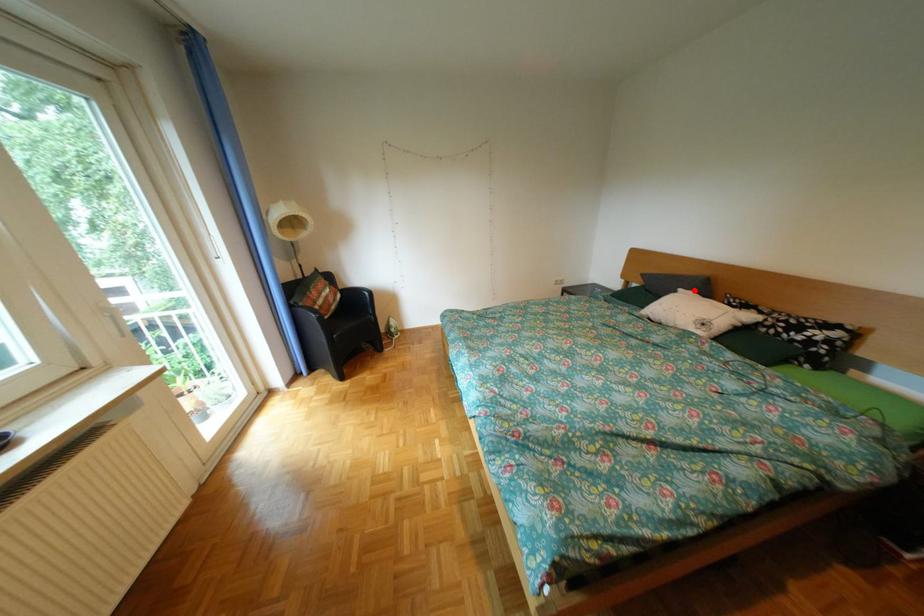
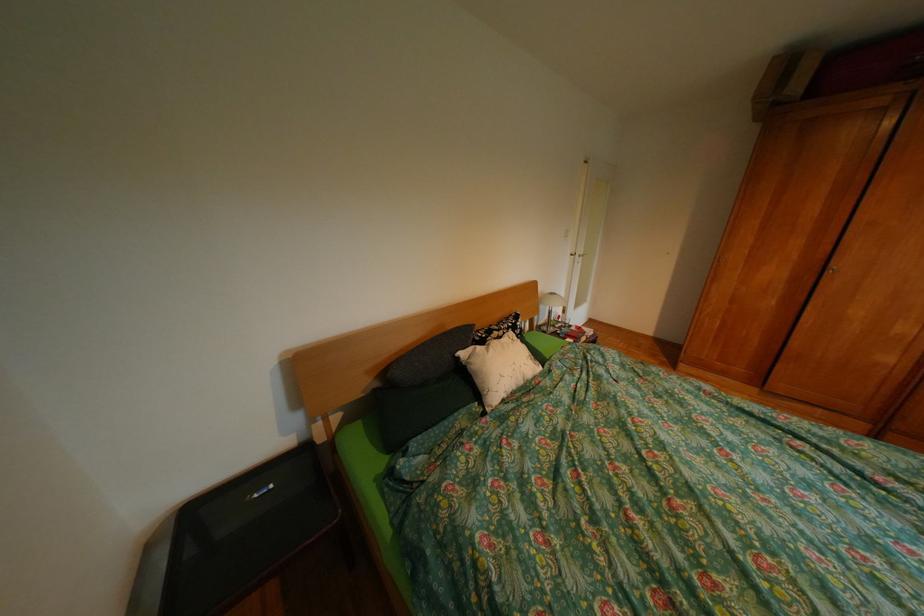
Question: I am providing you with two images of the same scene from different viewpoints. In image1, a red point is highlighted. Considering the same 3D point in image2, which of the following is correct?

Choices:
 (A) It is closer
 (B) It is farther

Answer: (B)